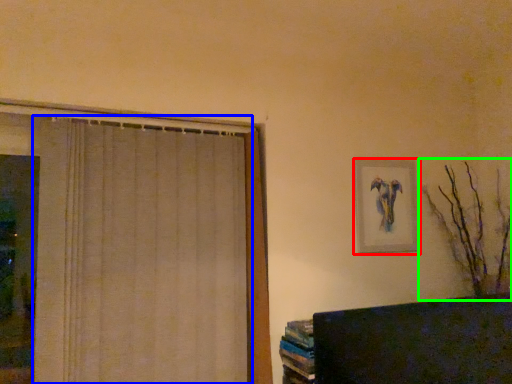
Question: Considering the real-world distances, which object is farthest from picture frame (highlighted by a red box)? curtain (highlighted by a blue box) or branch (highlighted by a green box)?

Choices:
 (A) curtain
 (B) branch

Answer: (A)